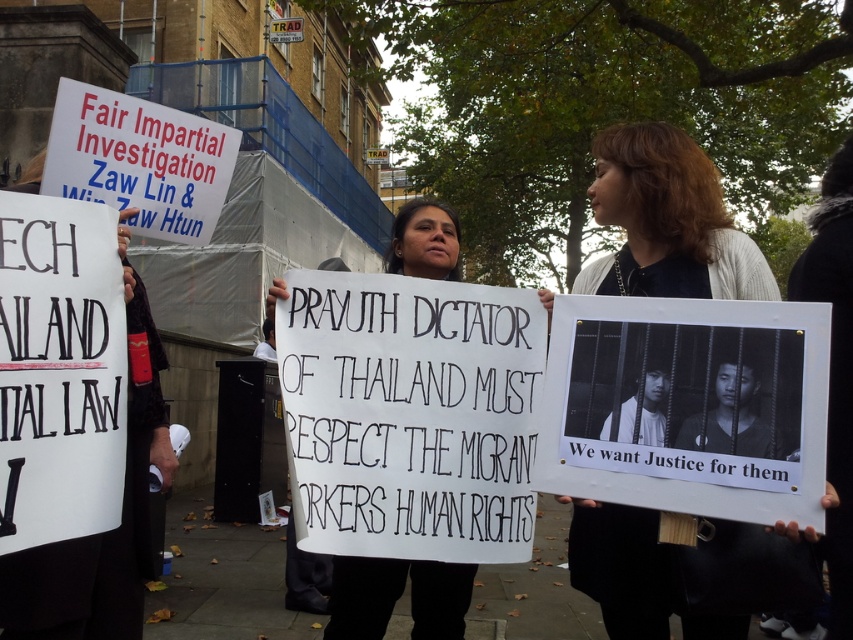
You are a photographer trying to capture a clear shot of the protest signs. You notice the matte white cardigan at center and the white paper sign at center. Which object is taller and might block the view of the other?

The matte white cardigan at center is much taller than the white paper sign at center, so it might block the view of the white paper sign at center.